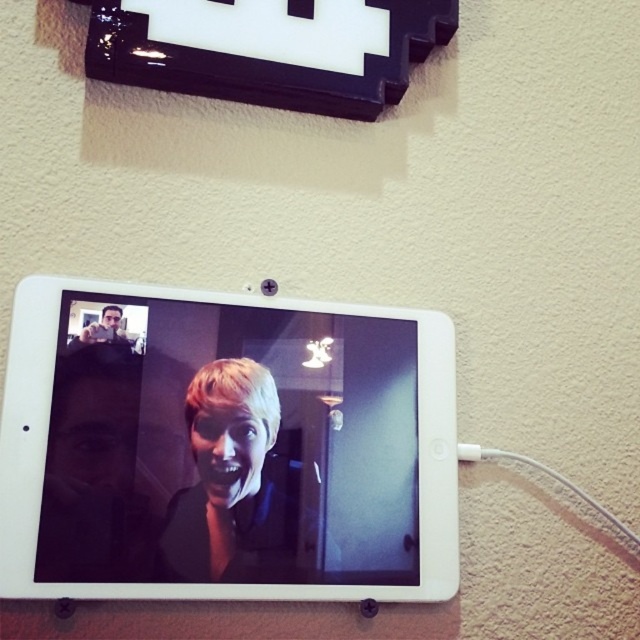
You are setting up a new picture frame on the wall next to the white glossy tablet at center and the matte black face at upper left. You want the frame to be taller than both of them. Which object should you use as a reference for the minimum height?

The white glossy tablet at center is much taller than the matte black face at upper left, so you should use the white glossy tablet at center as the reference for the minimum height to ensure the new frame is taller than both.

You are holding a ruler and want to measure the distance between the white glossy tablet at center and the matte black face at upper left. According to the scene, how far apart are they?

The white glossy tablet at center is 7.61 inches from matte black face at upper left.

You are holding a white glossy tablet at center and want to place it on a shelf that can only hold items smaller than it. There is a matte black face at left nearby. Which item should you place on the shelf?

The matte black face at left should be placed on the shelf since it is smaller than the white glossy tablet at center.